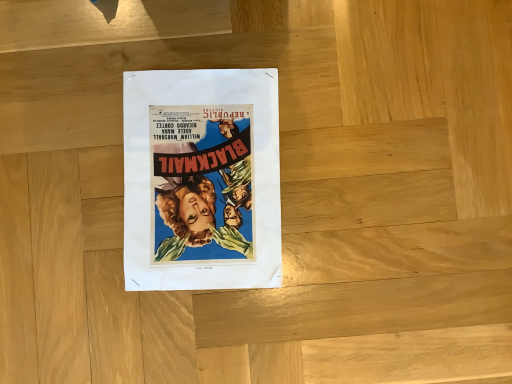
What do you see at coordinates (201, 179) in the screenshot? Image resolution: width=512 pixels, height=384 pixels. I see `matte paper poster at center` at bounding box center [201, 179].

Measure the distance between matte paper poster at center and camera.

21.99 inches.

Where is `matte paper poster at center`? matte paper poster at center is located at coordinates (201, 179).

Where is `matte paper poster at center`? This screenshot has height=384, width=512. matte paper poster at center is located at coordinates (201, 179).